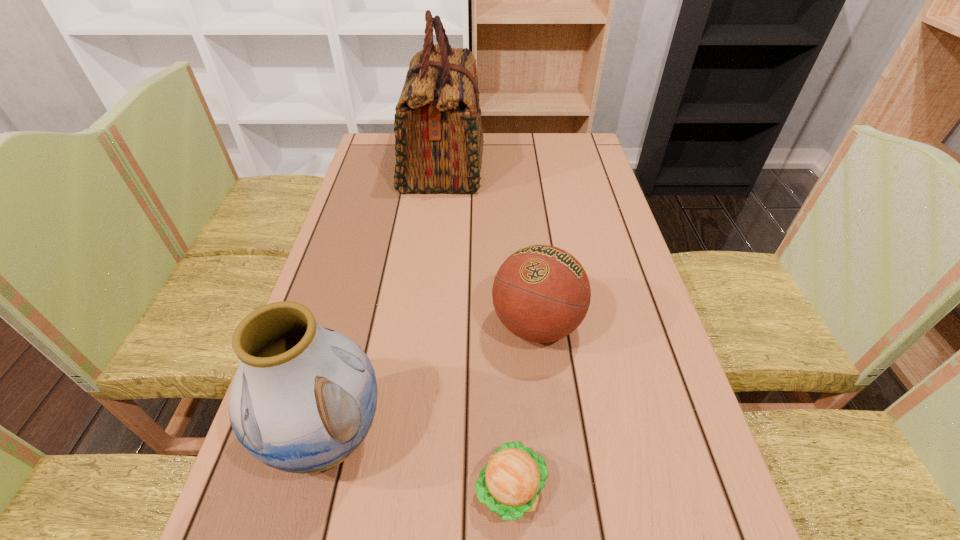
At what (x,y) coordinates should I click in order to perform the action: click on unoccupied area between the vase and the second shortest object. Please return your answer as a coordinate pair (x, y). This screenshot has height=540, width=960. Looking at the image, I should click on (432, 380).

Locate an element on the screen. This screenshot has width=960, height=540. vacant space that's between the second shortest object and the second tallest object is located at coordinates (432, 380).

Identify the location of vacant space in between the hamburger and the farthest object. (477, 327).

You are a GUI agent. You are given a task and a screenshot of the screen. Output one action in this format:
    pyautogui.click(x=<x>, y=<y>)
    Task: Click on the free space between the vase and the shortest object
    Image resolution: width=960 pixels, height=540 pixels.
    Given the screenshot: What is the action you would take?
    pyautogui.click(x=420, y=462)

Identify the location of free point between the shopping bag and the second farthest object. (490, 245).

Identify the location of blank region between the basketball and the hamburger. Image resolution: width=960 pixels, height=540 pixels. (523, 407).

This screenshot has height=540, width=960. I want to click on free space between the vase and the basketball, so click(x=432, y=380).

This screenshot has width=960, height=540. Find the location of `free spot between the second tallest object and the third tallest object`. free spot between the second tallest object and the third tallest object is located at coordinates (432, 380).

Image resolution: width=960 pixels, height=540 pixels. Identify the location of object that is the closest to the tallest object. (541, 293).

At what (x,y) coordinates should I click in order to perform the action: click on the closest object relative to the farthest object. Please return your answer as a coordinate pair (x, y). Looking at the image, I should click on (541, 293).